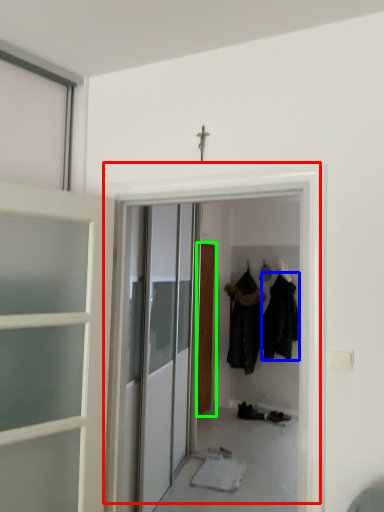
Question: Which is nearer to the door (highlighted by a red box)? clothing (highlighted by a blue box) or door (highlighted by a green box).

Choices:
 (A) clothing
 (B) door

Answer: (B)